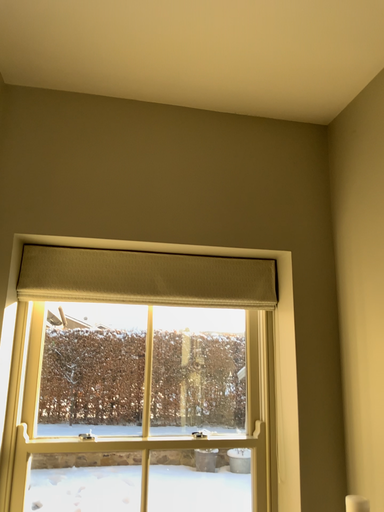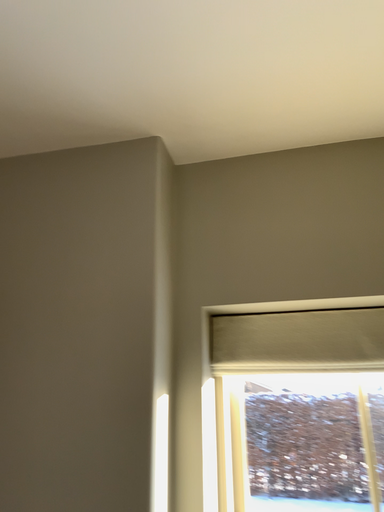
Question: Which way did the camera rotate in the video?

Choices:
 (A) rotated right
 (B) rotated left

Answer: (B)